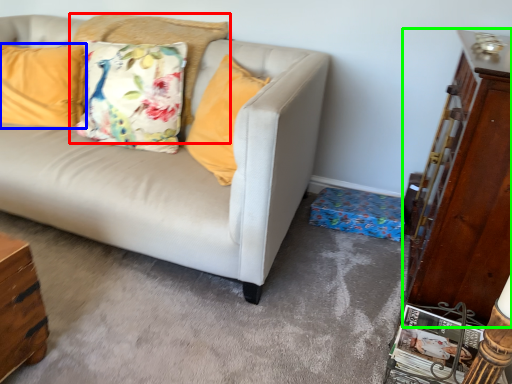
Question: Which object is positioned closest to pillow (highlighted by a red box)? Select from pillow (highlighted by a blue box) and dresser (highlighted by a green box).

Choices:
 (A) pillow
 (B) dresser

Answer: (A)